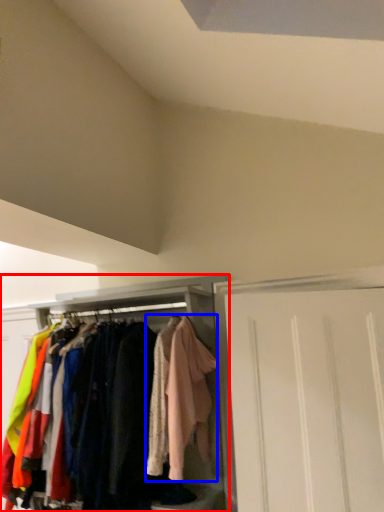
Question: Which object appears farthest to the camera in this image, cabinetry (highlighted by a red box) or clothing (highlighted by a blue box)?

Choices:
 (A) cabinetry
 (B) clothing

Answer: (A)